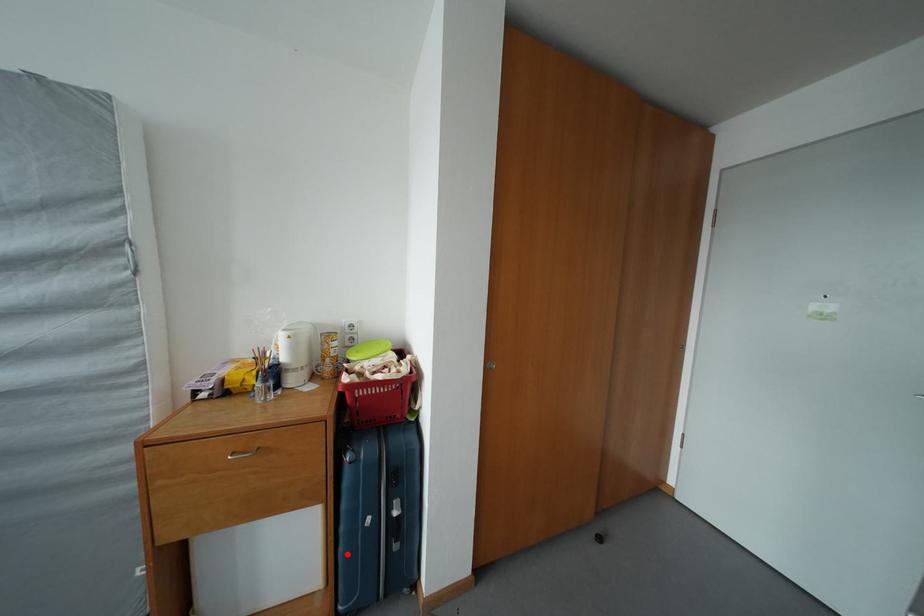
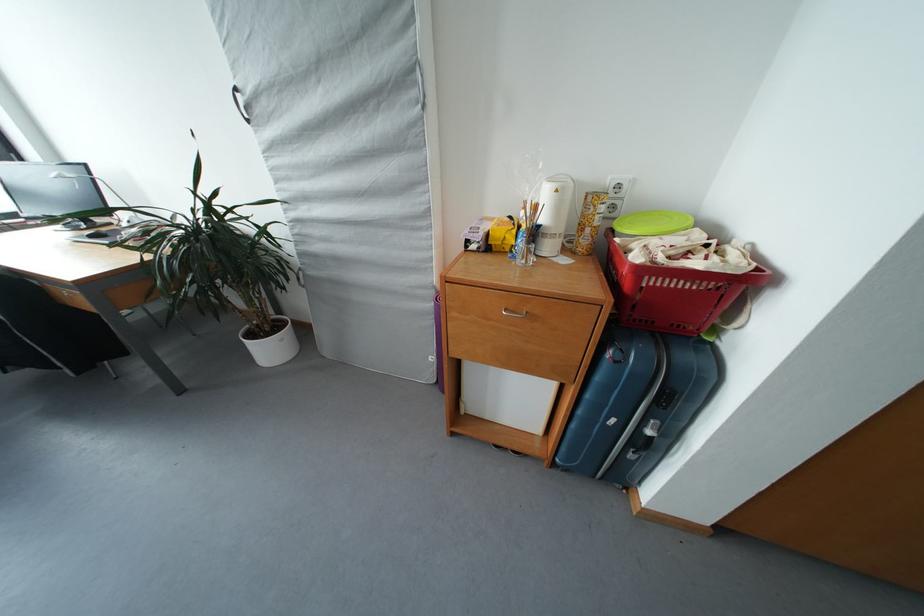
In the second image, find the point that corresponds to the highlighted location in the first image.

(579, 431)